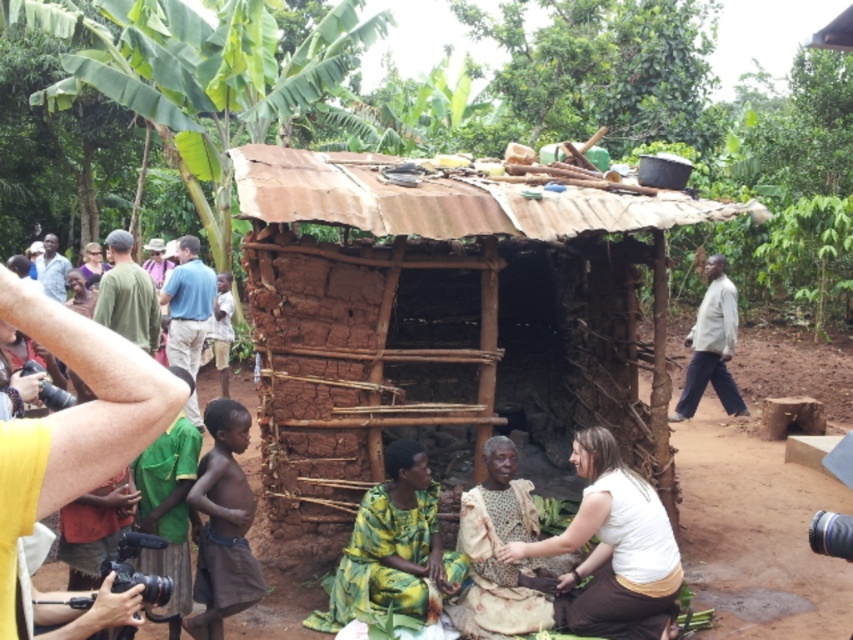
You are standing at the entrance of the rustic hut and need to reach both the brown cloth at lower left and the matte brown shirt at left. Which item is closer to you?

The brown cloth at lower left is 8.74 meters away from the matte brown shirt at left, so the matte brown shirt at left is closer to you since it is only 8.74 meters away from the brown cloth at lower left.

You are a tailor who needs to determine which shirt requires more fabric to make between the white cotton shirt at right and the green fabric shirt at left based on their sizes. Which one would need more fabric?

The white cotton shirt at right requires more fabric because its width is larger than the green fabric shirt at left.

You are standing in front of the rustic mud hut and notice two items near the entrance. The brown cloth at lower left and the green fabric shirt at left are both visible. Which item is positioned closer to the ground?

The brown cloth at lower left is located below the green fabric shirt at left, so it is closer to the ground.